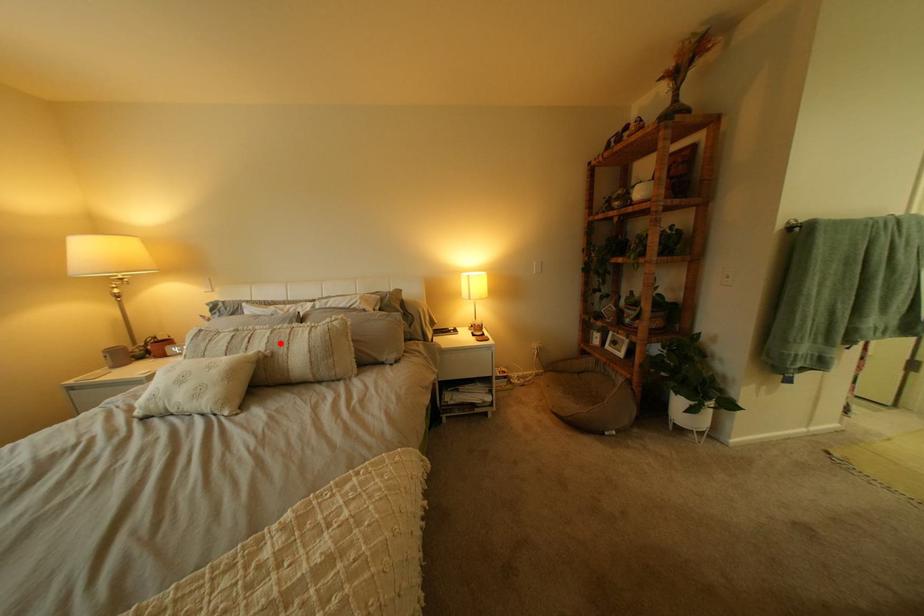
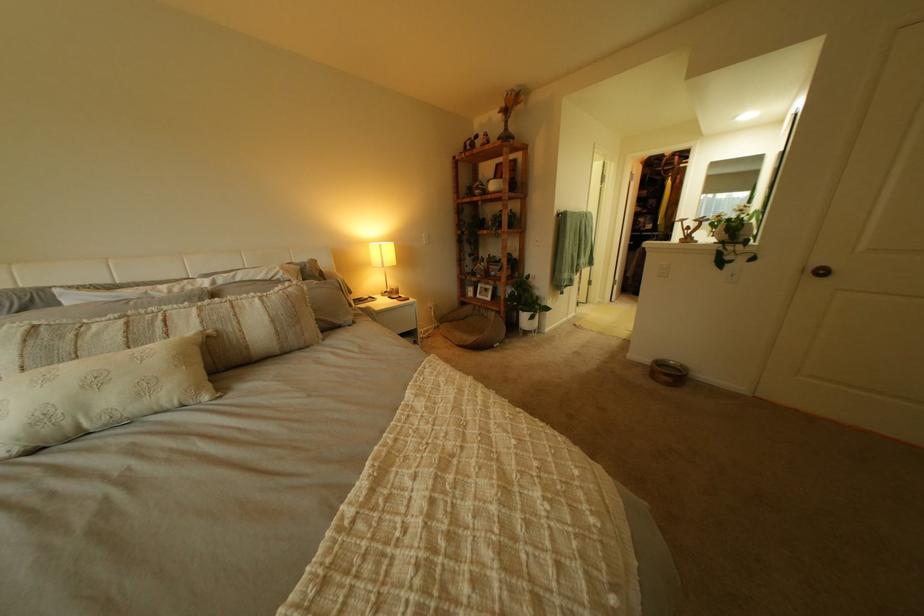
Question: I am providing you with two images of the same scene from different viewpoints. A red point is marked on the first image. Can you still see the location of the red point in image 2?

Choices:
 (A) Yes
 (B) No

Answer: (A)